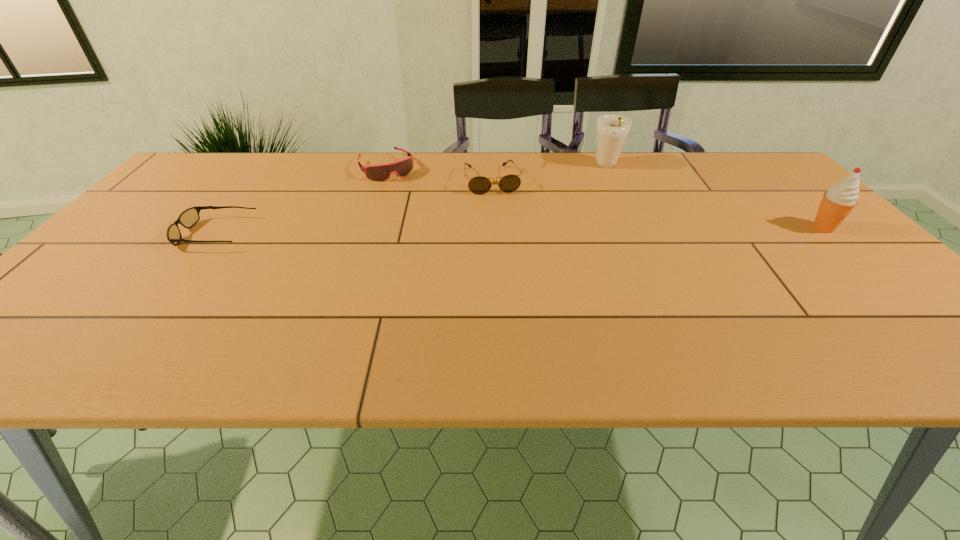
Where is `vacant area that lies between the icecream and the right sunglasses`? This screenshot has width=960, height=540. vacant area that lies between the icecream and the right sunglasses is located at coordinates (658, 204).

Where is `free point between the icecream and the right sunglasses`? This screenshot has height=540, width=960. free point between the icecream and the right sunglasses is located at coordinates (658, 204).

Image resolution: width=960 pixels, height=540 pixels. Find the location of `free space that is in between the goggles and the icecream`. free space that is in between the goggles and the icecream is located at coordinates (605, 198).

Locate an element on the screen. free space between the shorter sunglasses and the farther sunglasses is located at coordinates (353, 207).

Find the location of a particular element. free space that is in between the second object from left to right and the fourth object from left to right is located at coordinates (496, 167).

Where is `vacant region between the goggles and the fourth object from left to right`? Image resolution: width=960 pixels, height=540 pixels. vacant region between the goggles and the fourth object from left to right is located at coordinates (496, 167).

Locate an element on the screen. This screenshot has height=540, width=960. free space between the rightmost object and the right sunglasses is located at coordinates (658, 204).

The image size is (960, 540). I want to click on free area in between the right sunglasses and the rightmost object, so click(x=658, y=204).

Find the location of a particular element. vacant region between the goggles and the icecream is located at coordinates (605, 198).

You are a GUI agent. You are given a task and a screenshot of the screen. Output one action in this format:
    pyautogui.click(x=<x>, y=<y>)
    Task: Click on the object that stands as the closest to the third object from left to right
    This screenshot has width=960, height=540.
    Given the screenshot: What is the action you would take?
    pyautogui.click(x=381, y=172)